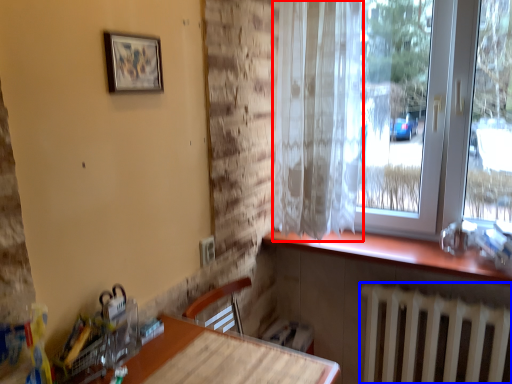
Question: Among these objects, which one is farthest to the camera, curtain (highlighted by a red box) or radiator (highlighted by a blue box)?

Choices:
 (A) curtain
 (B) radiator

Answer: (B)